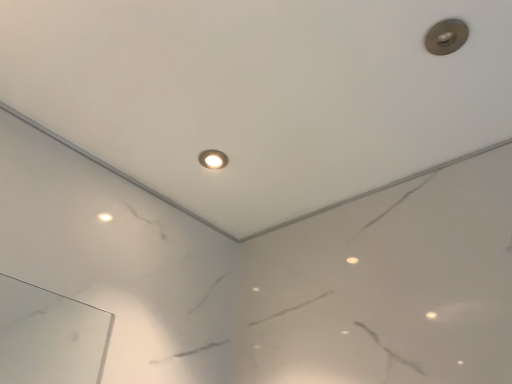
The image size is (512, 384). Describe the element at coordinates (213, 159) in the screenshot. I see `matte white droplight at center` at that location.

What is the approximate width of matte white droplight at center?

The width of matte white droplight at center is 3.64 inches.

This screenshot has width=512, height=384. In order to click on matte white droplight at center in this screenshot , I will do `click(213, 159)`.

This screenshot has width=512, height=384. I want to click on matte white droplight at center, so click(213, 159).